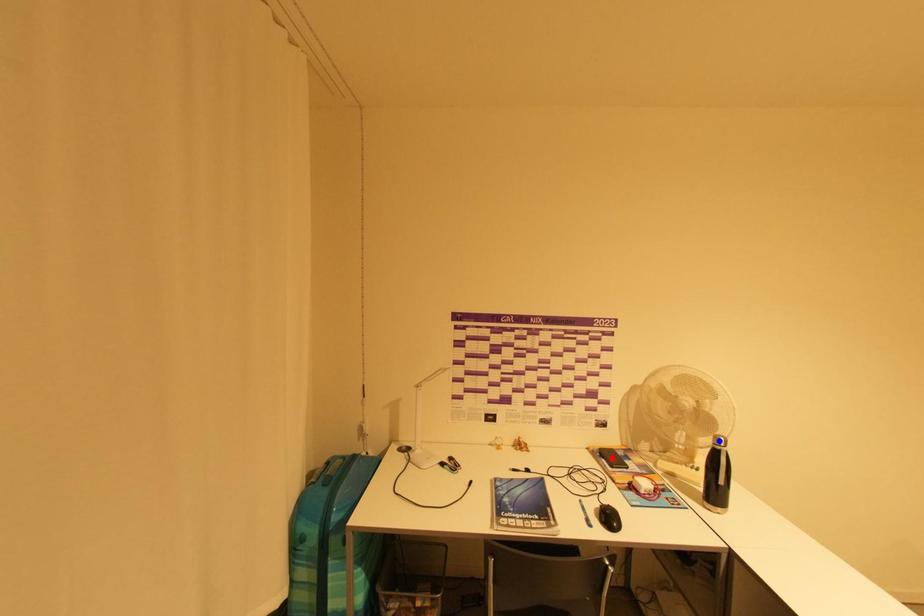
Question: In the image, two points are highlighted. Which point is nearer to the camera? Reply with the corresponding letter.

Choices:
 (A) blue point
 (B) red point

Answer: (A)